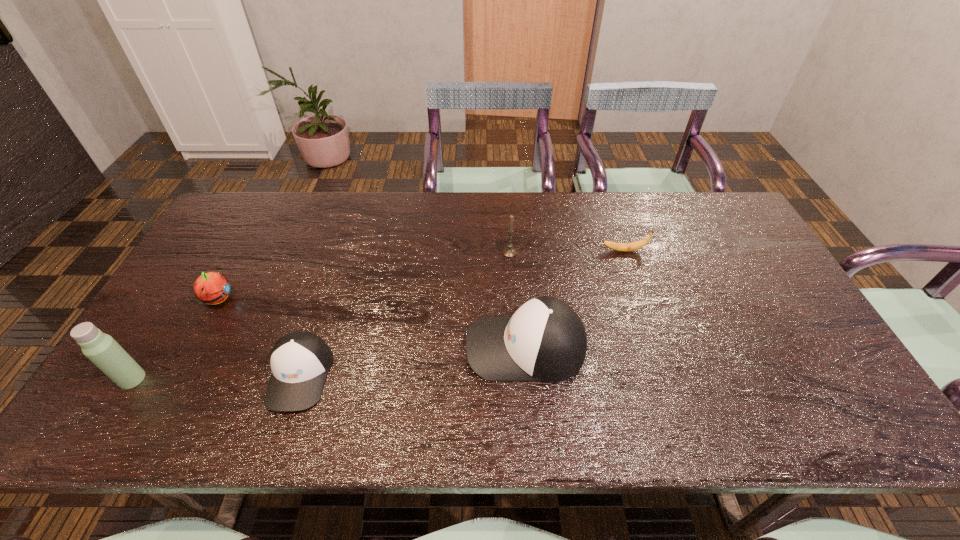
Find the location of a particular element. The height and width of the screenshot is (540, 960). the shorter cap is located at coordinates (300, 360).

The height and width of the screenshot is (540, 960). In order to click on the third object from left to right in this screenshot , I will do `click(300, 360)`.

This screenshot has width=960, height=540. In order to click on the taller cap in this screenshot , I will do `click(545, 340)`.

Image resolution: width=960 pixels, height=540 pixels. In order to click on the fifth object from right to left in this screenshot , I will do tap(212, 288).

Identify the location of the fourth nearest object. This screenshot has width=960, height=540. (212, 288).

The image size is (960, 540). In order to click on candle in this screenshot , I will do `click(509, 251)`.

This screenshot has height=540, width=960. I want to click on the shortest object, so click(623, 247).

Identify the location of the rightmost object. The width and height of the screenshot is (960, 540). (623, 247).

This screenshot has width=960, height=540. I want to click on the leftmost object, so click(100, 348).

Identify the location of the tallest object. This screenshot has height=540, width=960. (100, 348).